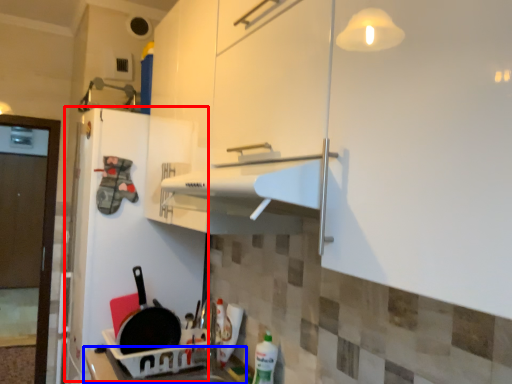
Question: Which of the following is the farthest to the observer, fridge (highlighted by a red box) or counter top (highlighted by a blue box)?

Choices:
 (A) fridge
 (B) counter top

Answer: (A)